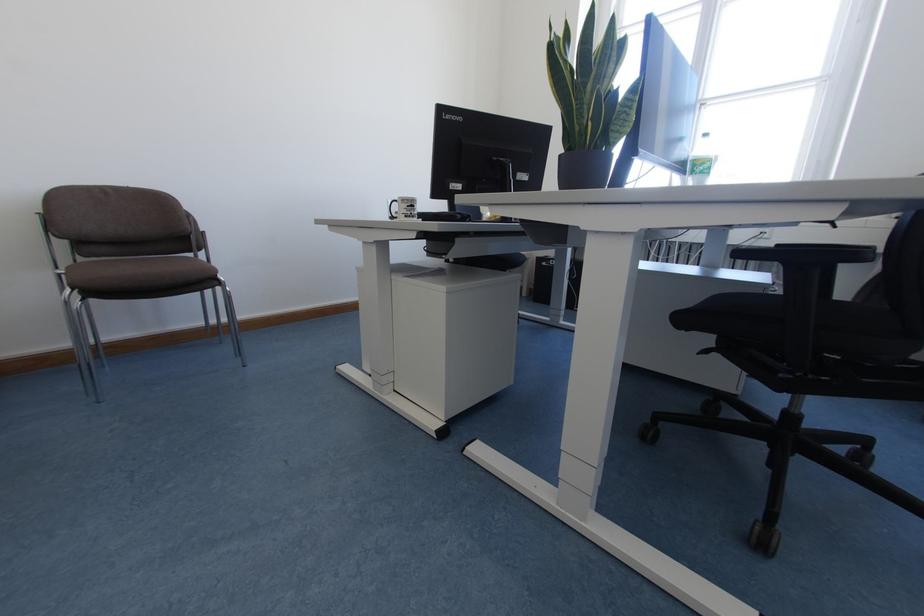
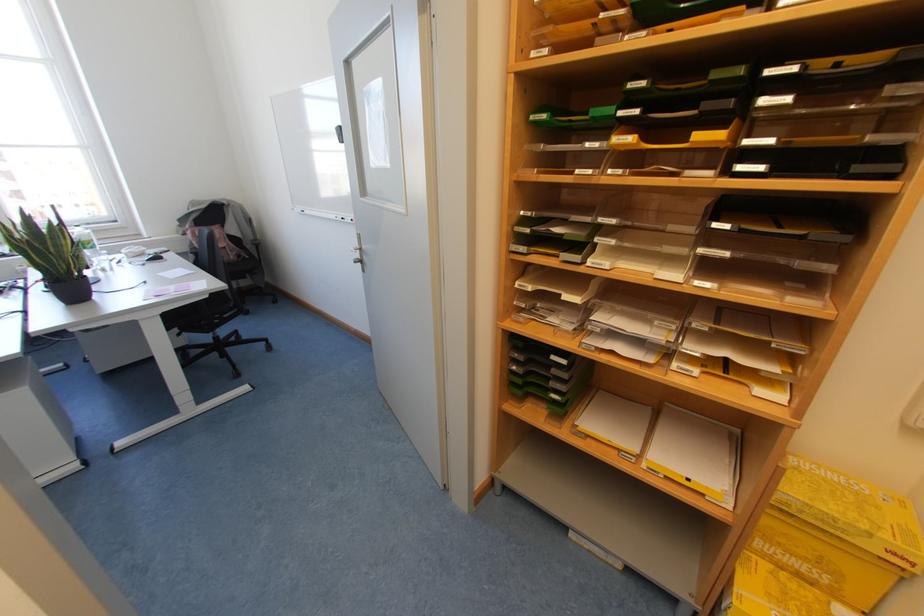
Where in the second image is the point corresponding to (593,77) from the first image?

(53, 245)